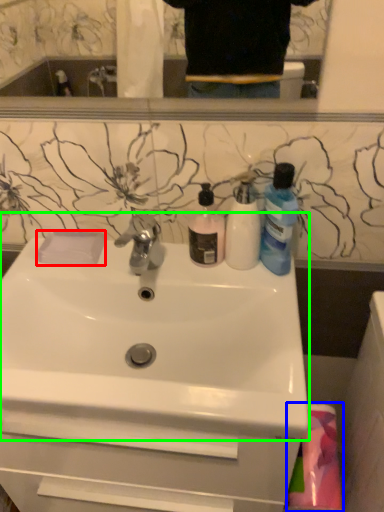
Question: Considering the real-world distances, which object is closest to soap (highlighted by a red box)? material (highlighted by a blue box) or sink (highlighted by a green box).

Choices:
 (A) material
 (B) sink

Answer: (B)